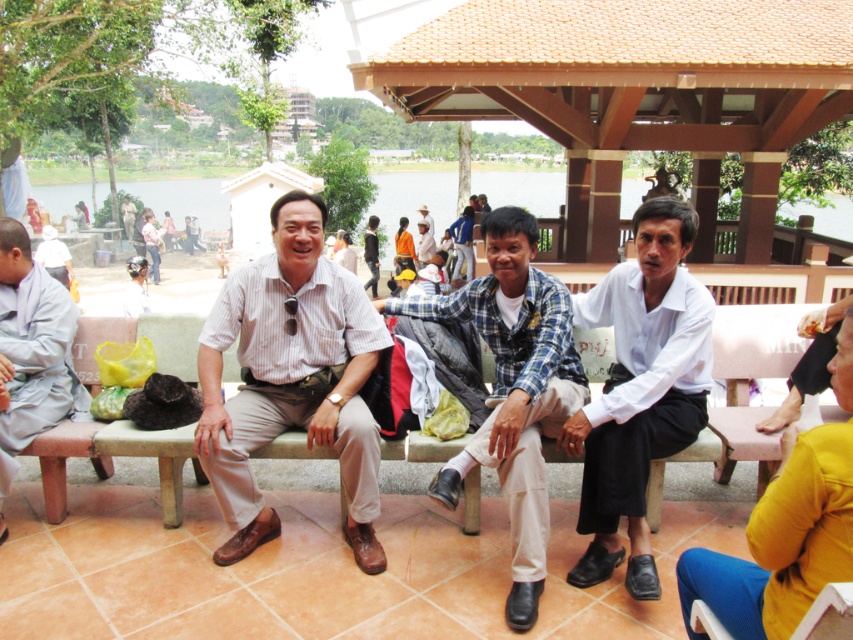
You are a photographer standing in front of the pavilion. You see a person wearing a white striped shirt at center and another wearing a light gray monk robe at left. Which one is more to the left?

The light gray monk robe at left is more to the left than the white striped shirt at center.

Based on the photo, you are a photographer trying to capture a group photo of the blue plaid shirt at center and the light gray monk robe at left. Since you want to ensure both subjects are in focus, you need to know which one is closer to the camera. Can you determine which subject is nearer to the camera based on their sizes?

The blue plaid shirt at center has a larger size compared to the light gray monk robe at left, which indicates that the blue plaid shirt at center is closer to the camera.